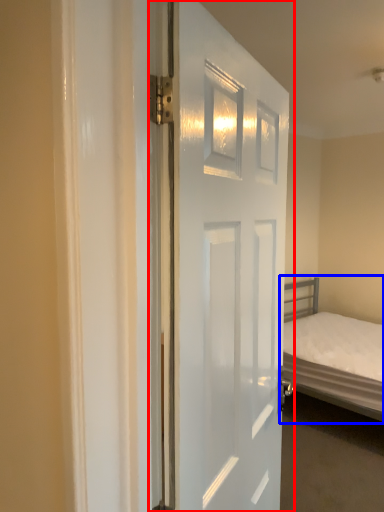
Question: Which point is further to the camera, door (highlighted by a red box) or bed (highlighted by a blue box)?

Choices:
 (A) door
 (B) bed

Answer: (B)